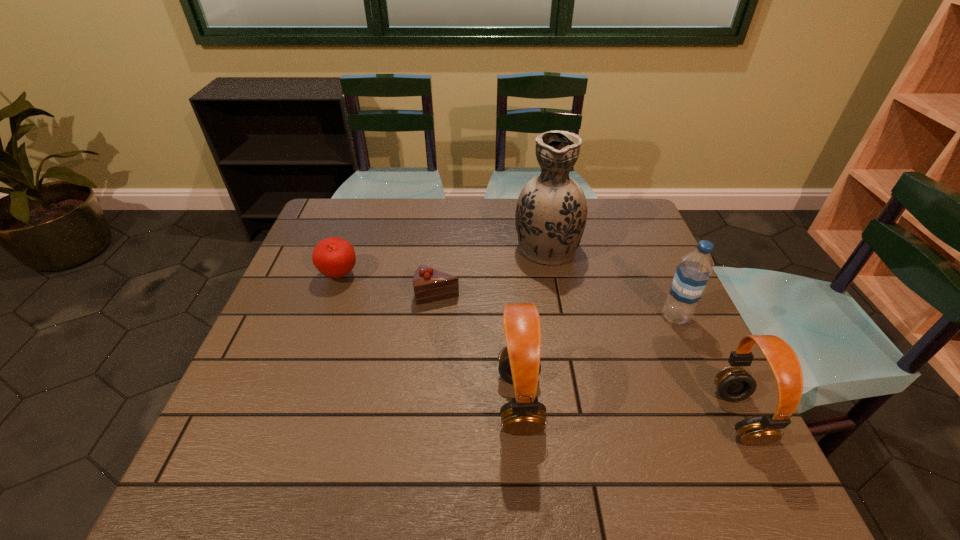
Please point a spot to add another headset on the left. Please provide its 2D coordinates. Your answer should be formatted as a tuple, i.e. [(x, y)], where the tuple contains the x and y coordinates of a point satisfying the conditions above.

[(313, 388)]